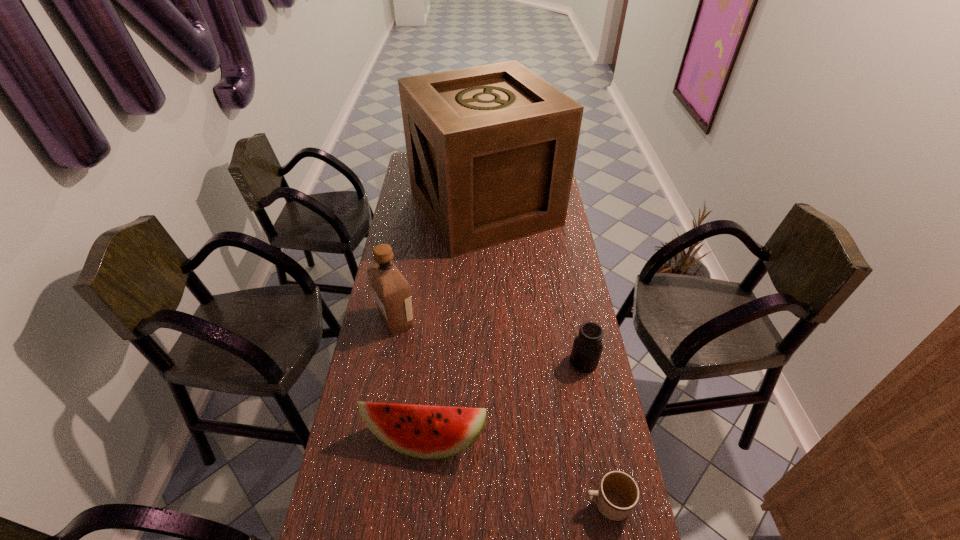
Locate an element on the screen. This screenshot has height=540, width=960. unoccupied area between the second tallest object and the farthest object is located at coordinates (441, 264).

Where is `free area in between the third farthest object and the mug`? free area in between the third farthest object and the mug is located at coordinates (595, 433).

You are a GUI agent. You are given a task and a screenshot of the screen. Output one action in this format:
    pyautogui.click(x=<x>, y=<y>)
    Task: Click on the vacant space in between the nearest object and the fourth shortest object
    The image size is (960, 540).
    Given the screenshot: What is the action you would take?
    pyautogui.click(x=501, y=412)

Locate an element on the screen. The height and width of the screenshot is (540, 960). free spot between the second shortest object and the fourth nearest object is located at coordinates (490, 341).

The height and width of the screenshot is (540, 960). I want to click on free space between the second farthest object and the fourth tallest object, so click(490, 341).

Find the location of a particular element. object that is the second closest to the nearest object is located at coordinates (587, 347).

The width and height of the screenshot is (960, 540). Find the location of `object that stands as the closest to the third nearest object`. object that stands as the closest to the third nearest object is located at coordinates (423, 431).

Identify the location of free space that satisfies the following two spatial constraints: 1. on the side of the mug with the handle; 2. on the outer rind of the third shortest object. The image size is (960, 540). (594, 438).

Locate an element on the screen. Image resolution: width=960 pixels, height=540 pixels. vacant space that satisfies the following two spatial constraints: 1. on the side of the mug with the handle; 2. on the front-facing side of the liquor is located at coordinates (571, 321).

Where is `vacant space that satisfies the following two spatial constraints: 1. on the outer rind of the third tallest object; 2. on the side of the mug with the handle`? The height and width of the screenshot is (540, 960). vacant space that satisfies the following two spatial constraints: 1. on the outer rind of the third tallest object; 2. on the side of the mug with the handle is located at coordinates (420, 504).